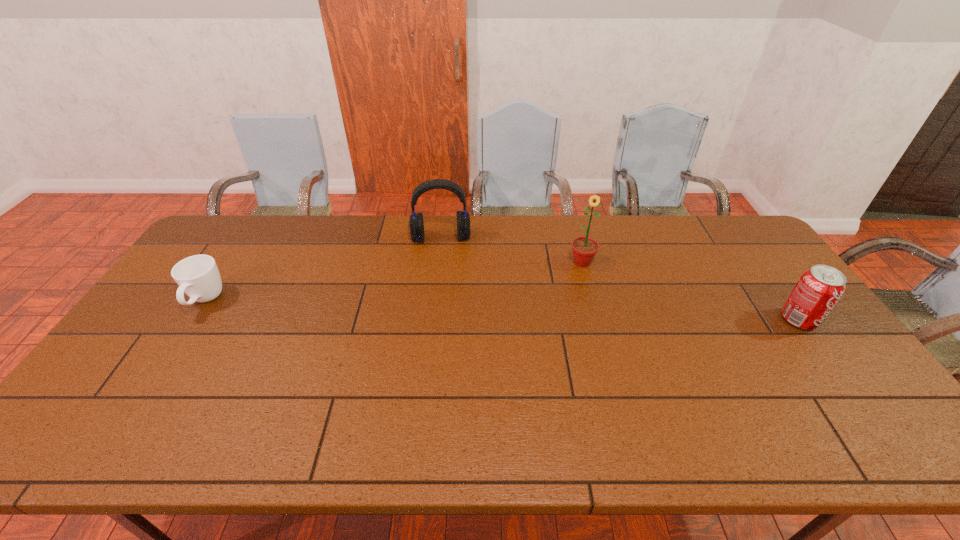
Find the location of `empty space that is in between the sunflower and the soda`. empty space that is in between the sunflower and the soda is located at coordinates (690, 291).

Find the location of a particular element. The height and width of the screenshot is (540, 960). empty space between the shortest object and the sunflower is located at coordinates (394, 282).

Identify the location of empty space that is in between the third object from right to left and the second farthest object. (512, 250).

The image size is (960, 540). Find the location of `empty location between the second shortest object and the headset`. empty location between the second shortest object and the headset is located at coordinates (620, 279).

Where is `the closest object to the cup`? Image resolution: width=960 pixels, height=540 pixels. the closest object to the cup is located at coordinates (416, 224).

Find the location of a particular element. object that is the second nearest to the shortest object is located at coordinates (584, 249).

The width and height of the screenshot is (960, 540). What are the coordinates of `free region that satisfies the following two spatial constraints: 1. with the handle on the side of the cup; 2. on the left side of the soda` in the screenshot? It's located at (193, 319).